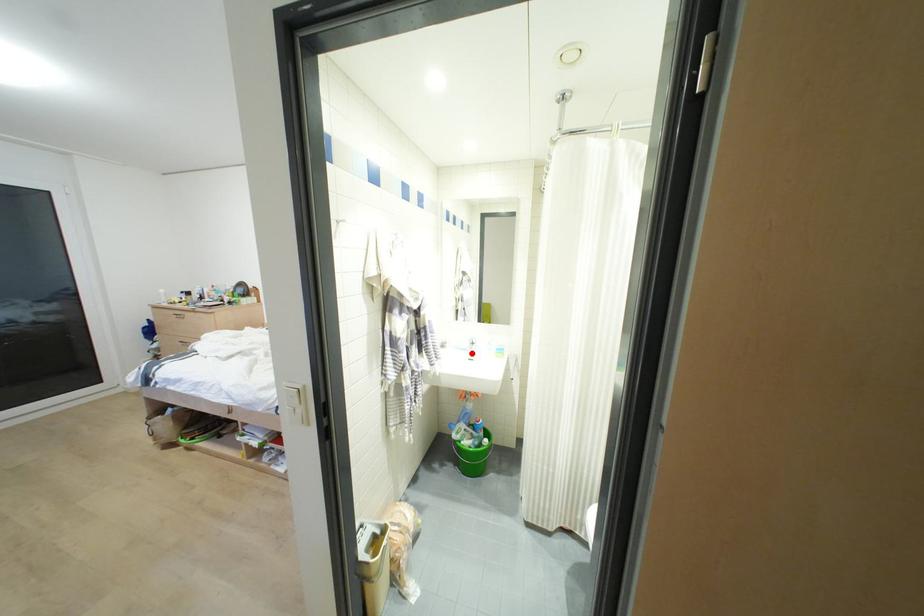
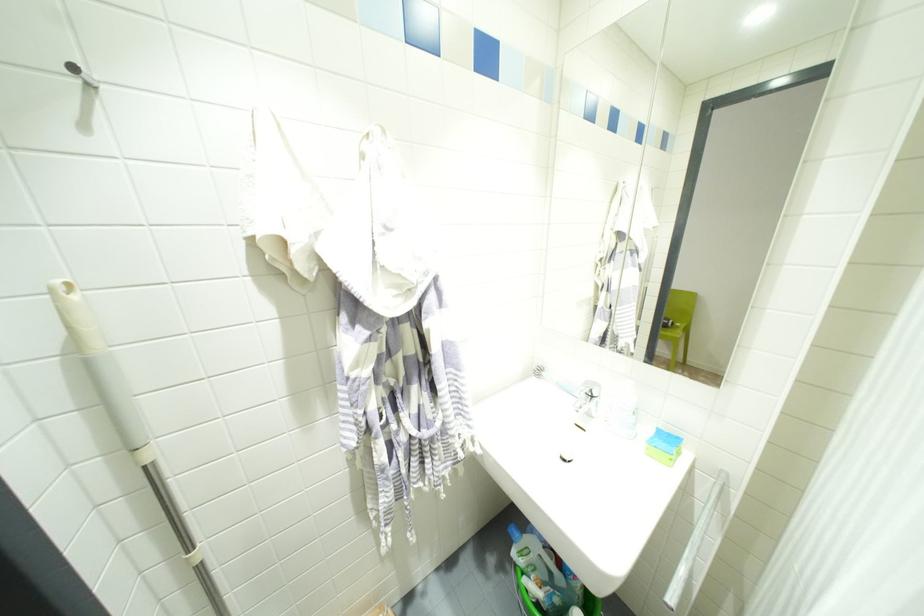
Question: I am providing you with two images of the same scene from different viewpoints. A red point is marked on the first image. Can you still see the location of the red point in image 2?

Choices:
 (A) Yes
 (B) No

Answer: (A)